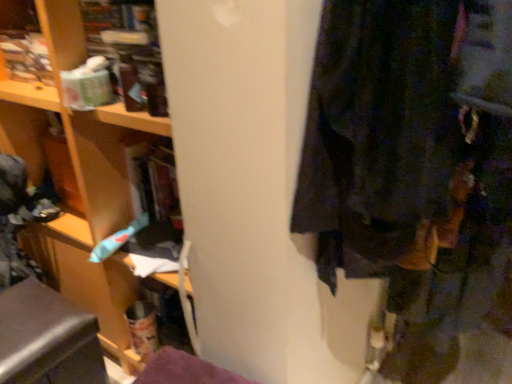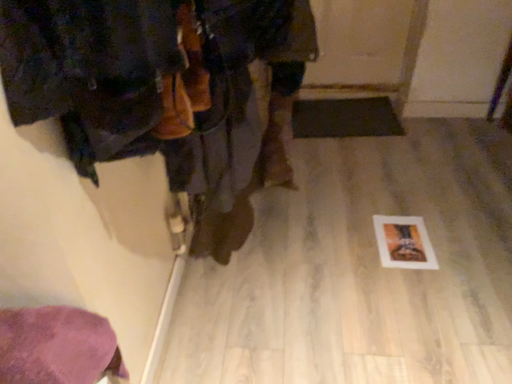
Question: How did the camera likely rotate when shooting the video?

Choices:
 (A) rotated upward
 (B) rotated downward

Answer: (B)